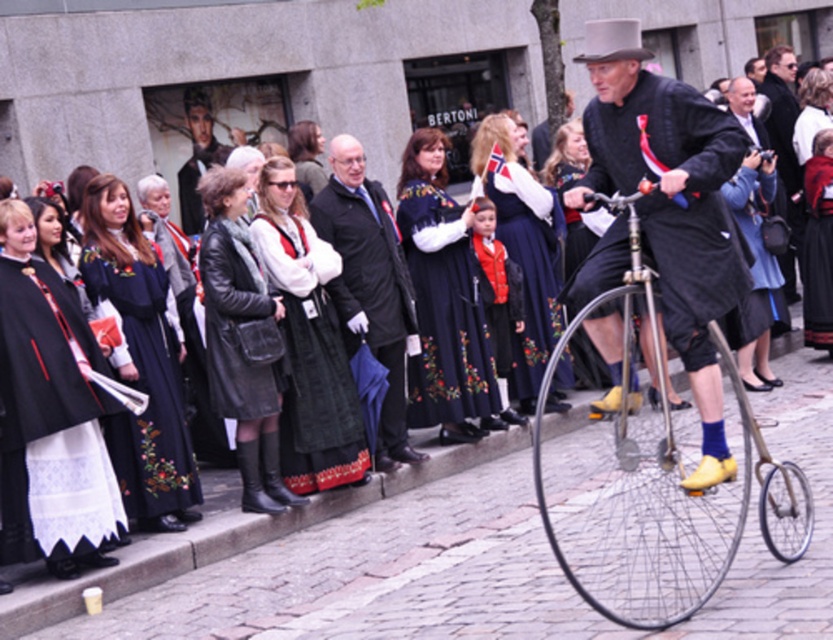
You are standing in the street scene and want to reach the point marked at coordinates [674,236]. The safety regulations state that you must stay at least 5 meters away from any moving objects. Is this point safe to approach?

The point marked at coordinates [674,236] is 5.65 meters away from the viewer, which is more than the required 5 meters safety distance. Therefore, it is safe to approach the point marked at coordinates [674,236].